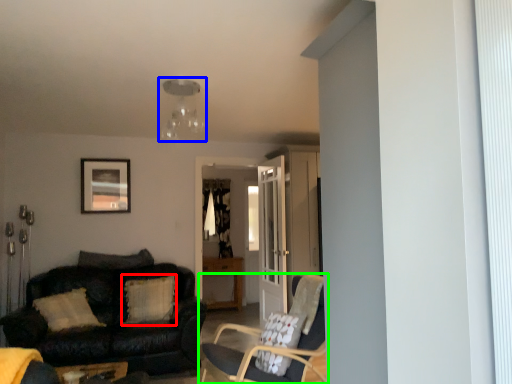
Question: Estimate the real-world distances between objects in this image. Which object is closer to pillow (highlighted by a red box), light fixture (highlighted by a blue box) or chair (highlighted by a green box)?

Choices:
 (A) light fixture
 (B) chair

Answer: (B)